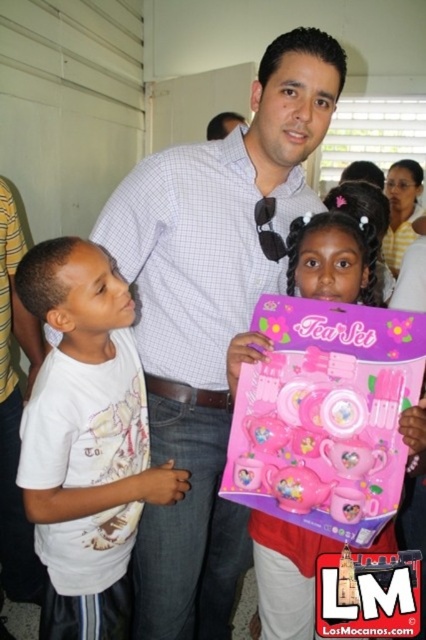
Can you confirm if white cotton shirt at left is positioned above pink plastic tea set at center?

Incorrect, white cotton shirt at left is not positioned above pink plastic tea set at center.

Does point (109, 460) lie in front of point (284, 593)?

Yes, it is in front of point (284, 593).

In order to click on white cotton shirt at left in this screenshot , I will do coord(86,440).